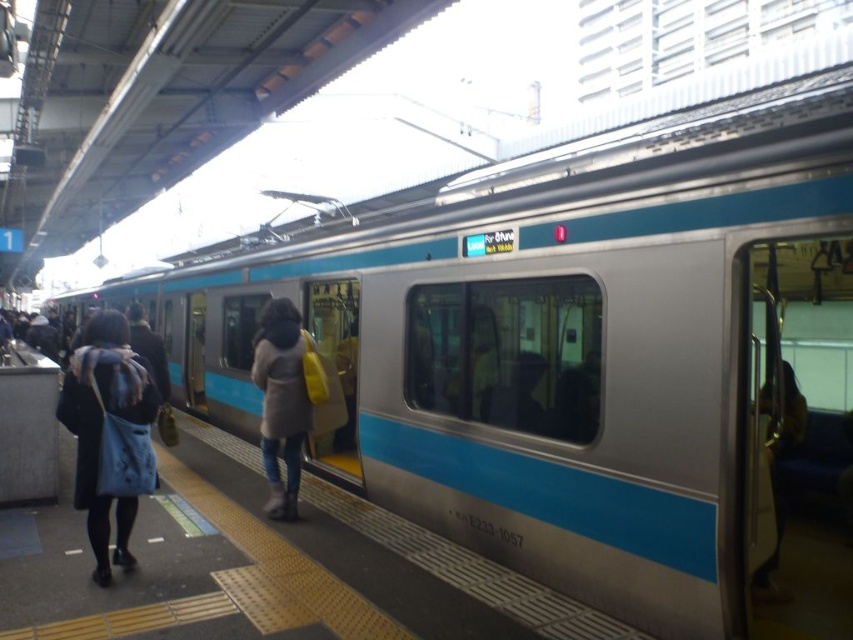
Question: Is black fabric coat at left bigger than light brown leather coat at center?

Choices:
 (A) yes
 (B) no

Answer: (A)

Question: Does black fabric coat at left come behind light brown leather coat at center?

Choices:
 (A) yes
 (B) no

Answer: (B)

Question: Which object appears closest to the camera in this image?

Choices:
 (A) light brown leather coat at center
 (B) black fabric coat at left

Answer: (B)

Question: Which of the following is the closest to the observer?

Choices:
 (A) (86, 374)
 (B) (254, 353)

Answer: (A)

Question: Is black fabric coat at left closer to camera compared to light brown leather coat at center?

Choices:
 (A) no
 (B) yes

Answer: (B)

Question: Among these points, which one is nearest to the camera?

Choices:
 (A) (82, 388)
 (B) (289, 444)

Answer: (A)